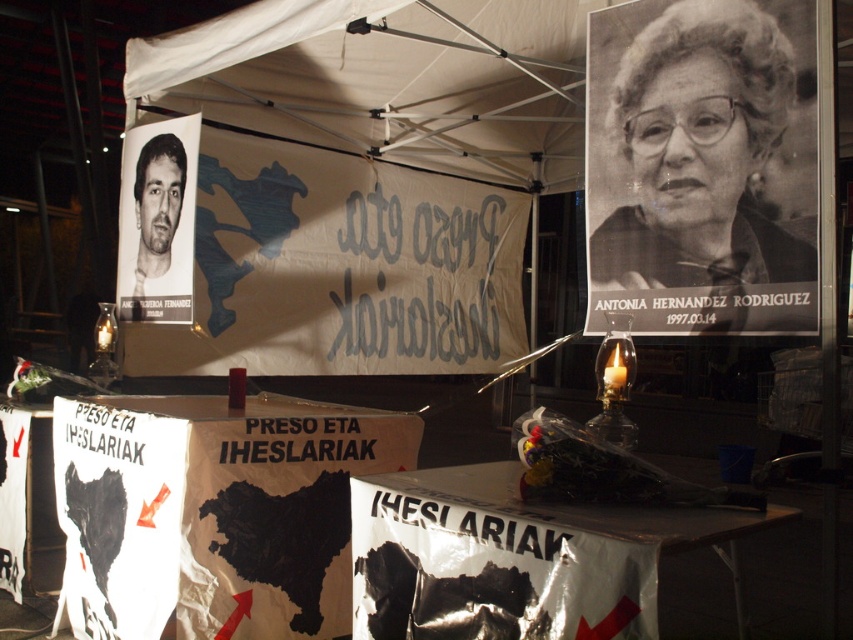
Is white paper poster at left smaller than metallic reflective table at center?

Incorrect, white paper poster at left is not smaller in size than metallic reflective table at center.

Which of these two, white paper poster at left or metallic reflective table at center, stands shorter?

metallic reflective table at center

Which is in front, point (210, 336) or point (552, 596)?

Positioned in front is point (552, 596).

Where is `white paper poster at left`? The height and width of the screenshot is (640, 853). white paper poster at left is located at coordinates (340, 268).

Is white paper poster at left positioned behind white paper map at center?

Result: Yes.

Which is in front, point (223, 232) or point (114, 456)?

Point (114, 456) is more forward.

Which is behind, point (274, 268) or point (218, 513)?

The point (274, 268) is more distant.

Find the location of a particular element. The image size is (853, 640). white paper poster at left is located at coordinates (340, 268).

Is white paper poster at left above black paper portrait at upper right?

Actually, white paper poster at left is below black paper portrait at upper right.

From the picture: Who is taller, white paper poster at left or black paper portrait at upper right?

white paper poster at left

Where is `white paper poster at left`? This screenshot has height=640, width=853. white paper poster at left is located at coordinates (340, 268).

Locate an element on the screen. This screenshot has width=853, height=640. white paper poster at left is located at coordinates (340, 268).